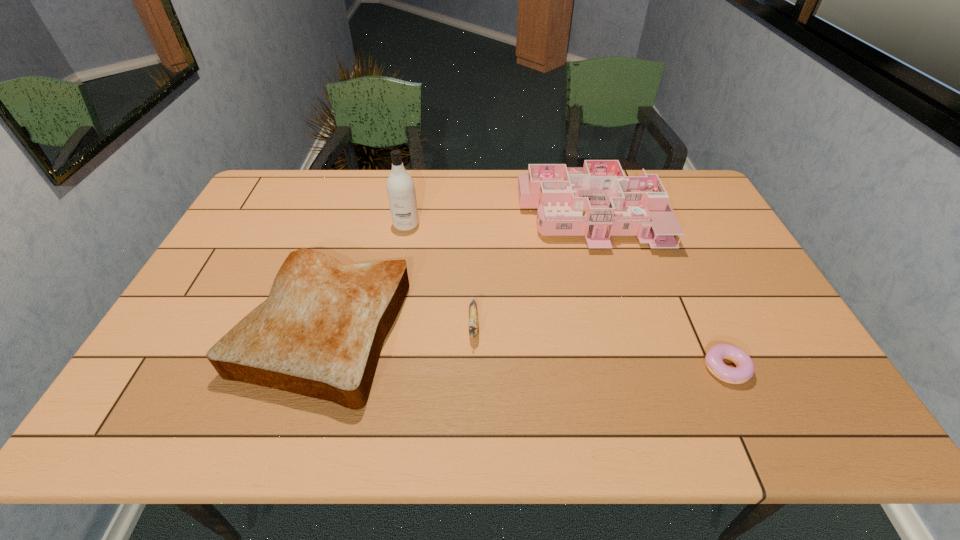
Identify the location of blank area located 0.060m on the front of the shortest object. The width and height of the screenshot is (960, 540). (745, 411).

At what (x,y) coordinates should I click in order to perform the action: click on object situated at the far edge. Please return your answer as a coordinate pair (x, y). The width and height of the screenshot is (960, 540). Looking at the image, I should click on (598, 198).

Where is `object present at the near edge`? The width and height of the screenshot is (960, 540). object present at the near edge is located at coordinates (320, 332).

Where is `object that is at the right edge`? This screenshot has height=540, width=960. object that is at the right edge is located at coordinates (744, 370).

In order to click on vacant area at the far edge in this screenshot , I will do `click(349, 181)`.

This screenshot has height=540, width=960. Find the location of `vacant region at the right edge of the desktop`. vacant region at the right edge of the desktop is located at coordinates (723, 300).

In the image, there is a desktop. Where is `vacant area at the far right corner`? vacant area at the far right corner is located at coordinates (694, 177).

The image size is (960, 540). Identify the location of vacant area between the shampoo and the shortest object. (565, 296).

I want to click on vacant space that's between the second tallest object and the shortest object, so click(657, 290).

Identify the location of vacant area that lies between the tallest object and the fourth shortest object. (497, 218).